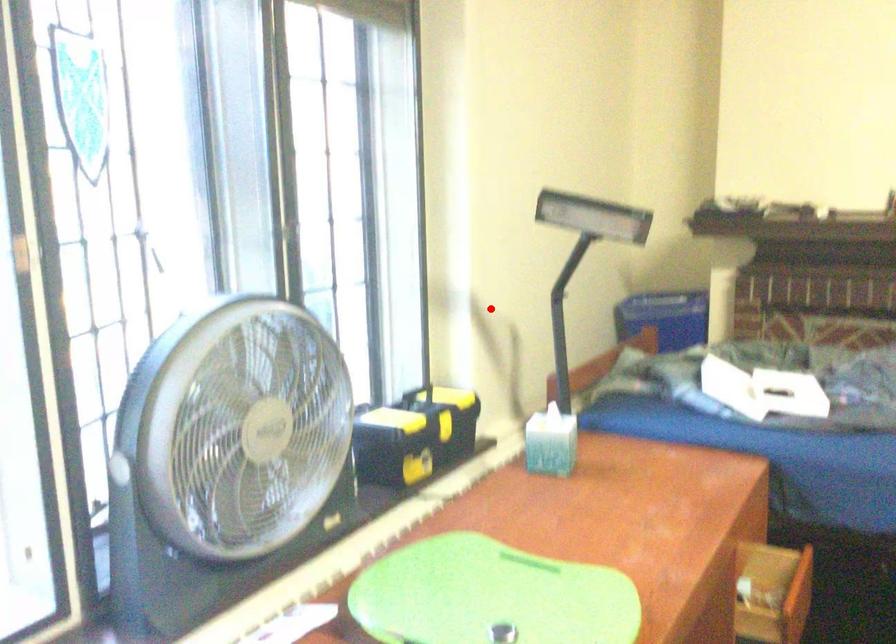
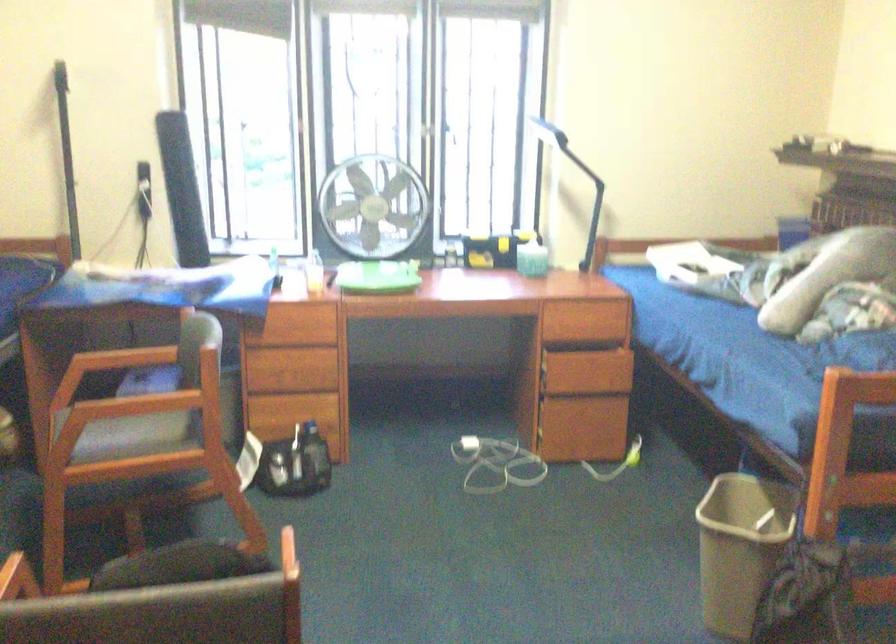
Question: I am providing you with two images of the same scene from different viewpoints. Image1 has a red point marked. In image2, the corresponding 3D location appears at what relative position? Reply with the corresponding letter.

Choices:
 (A) Closer
 (B) Farther

Answer: (B)